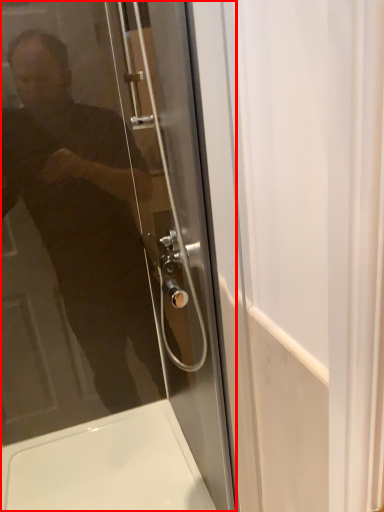
Question: From the image's perspective, where is door (annotated by the red box) located relative to bath?

Choices:
 (A) below
 (B) above

Answer: (B)